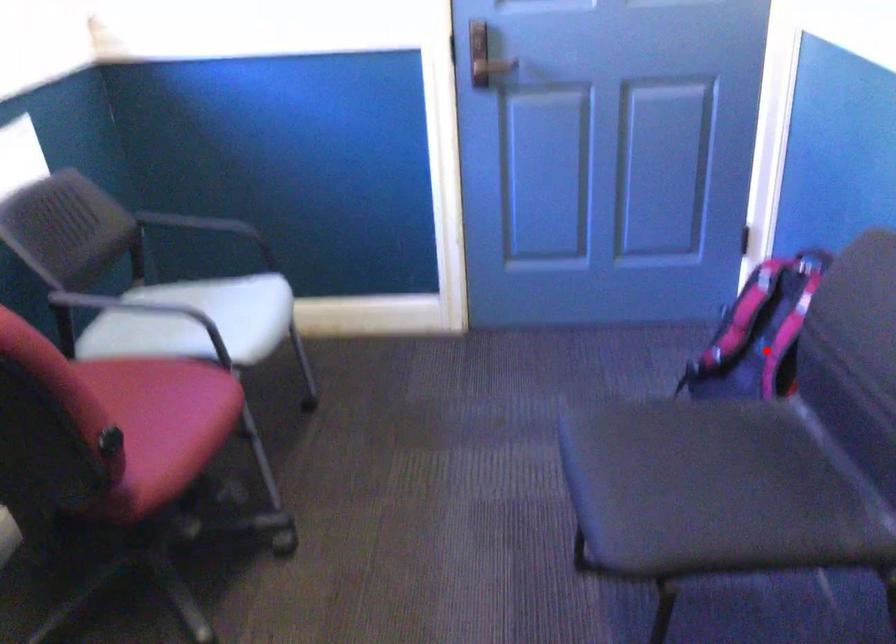
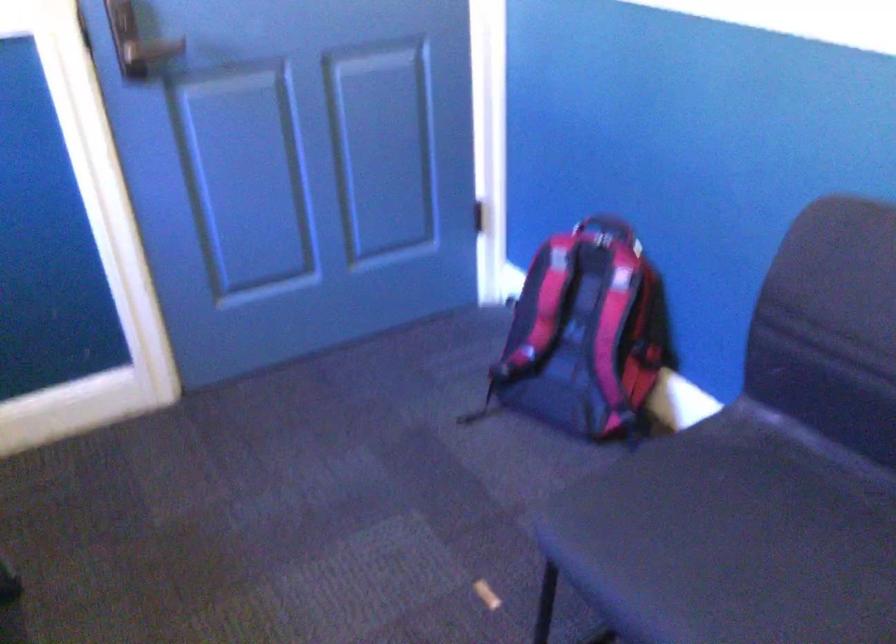
Question: I am providing you with two images of the same scene from different viewpoints. A red point is marked on the first image. Is the red point's position out of view in image 2?

Choices:
 (A) Yes
 (B) No

Answer: (B)